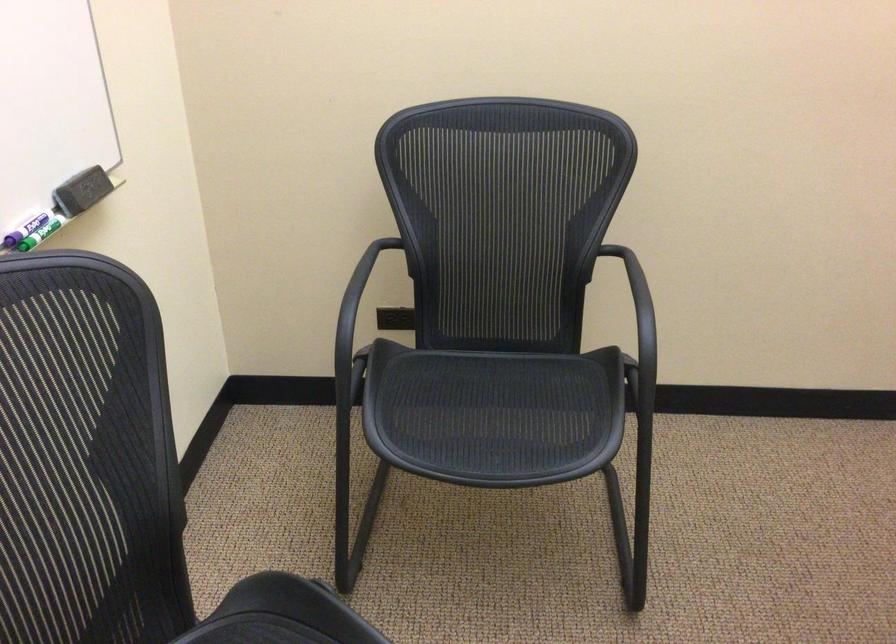
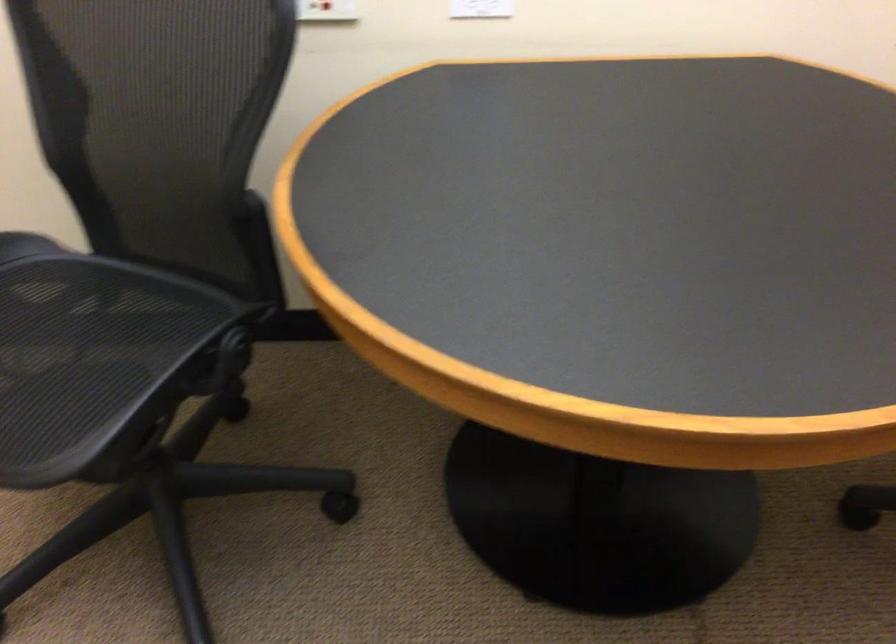
Based on the continuous images, in which direction is the camera rotating?

The camera rotated toward right-down.